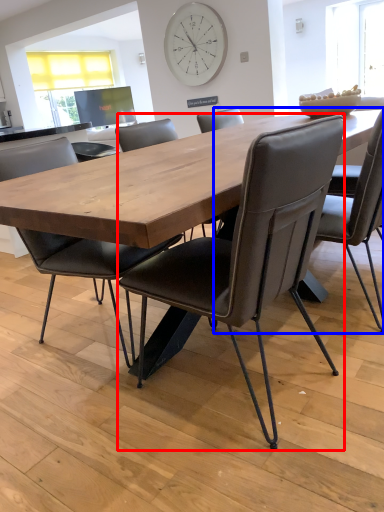
Question: Which point is closer to the camera, chair (highlighted by a red box) or chair (highlighted by a blue box)?

Choices:
 (A) chair
 (B) chair

Answer: (A)